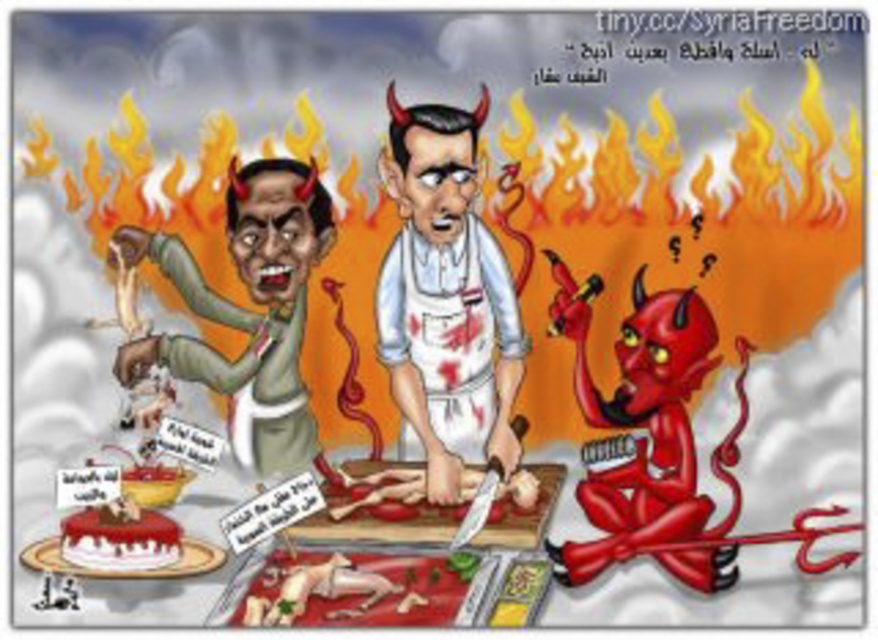
Does shiny red devil at center have a smaller size compared to white frosted cake at lower left?

No.

Between point (710, 563) and point (133, 536), which one is positioned in front?

Point (133, 536) is in front.

This screenshot has height=640, width=878. Identify the location of shiny red devil at center. (649, 435).

The image size is (878, 640). Find the location of `blood-stained apron butcher at center`. blood-stained apron butcher at center is located at coordinates (445, 296).

Who is more distant from viewer, (409, 404) or (128, 500)?

Point (409, 404)

Locate an element on the screen. This screenshot has width=878, height=640. blood-stained apron butcher at center is located at coordinates (445, 296).

Who is more distant from viewer, [286,262] or [77,563]?

Positioned behind is point [286,262].

Identify the location of green matte devil at left. (247, 310).

Which is behind, point (286, 465) or point (112, 520)?

Positioned behind is point (286, 465).

The height and width of the screenshot is (640, 878). What are the coordinates of `green matte devil at left` in the screenshot? It's located at (247, 310).